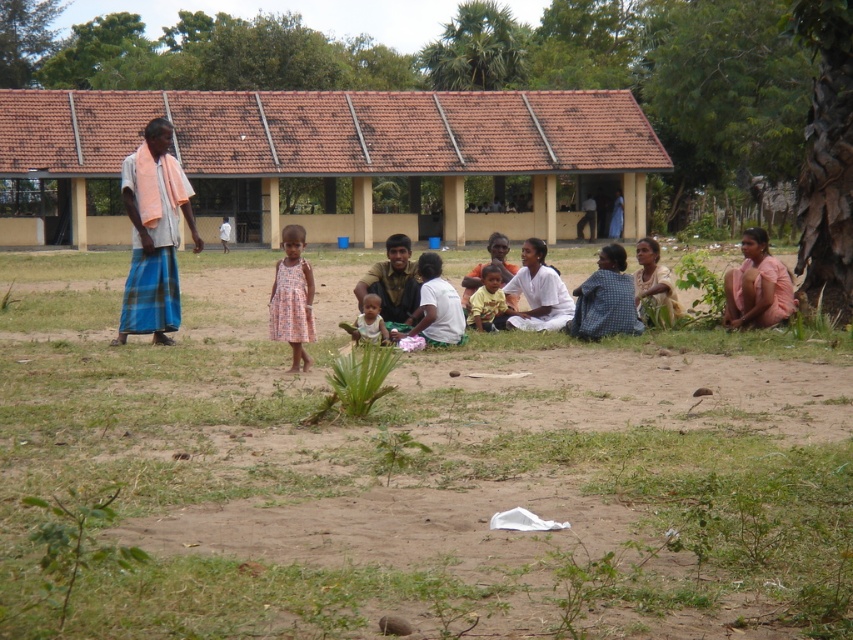
Is brown sandy ground at center to the right of pink fabric at lower right from the viewer's perspective?

No, brown sandy ground at center is not to the right of pink fabric at lower right.

Is brown sandy ground at center above pink fabric at lower right?

No, brown sandy ground at center is not above pink fabric at lower right.

Locate an element on the screen. This screenshot has height=640, width=853. brown sandy ground at center is located at coordinates (415, 472).

Does dusty pink dress at center have a smaller size compared to light brown fabric dress at right?

Incorrect, dusty pink dress at center is not smaller in size than light brown fabric dress at right.

Is dusty pink dress at center wider than light brown fabric dress at right?

In fact, dusty pink dress at center might be narrower than light brown fabric dress at right.

Locate an element on the screen. dusty pink dress at center is located at coordinates (292, 298).

Is light brown fabric child at center bigger than light pink fabric at center?

Correct, light brown fabric child at center is larger in size than light pink fabric at center.

Between light brown fabric child at center and light pink fabric at center, which one has more height?

With more height is light brown fabric child at center.

Between point (466, 304) and point (378, 340), which one is positioned behind?

Positioned behind is point (466, 304).

Identify the location of light brown fabric child at center. (500, 256).